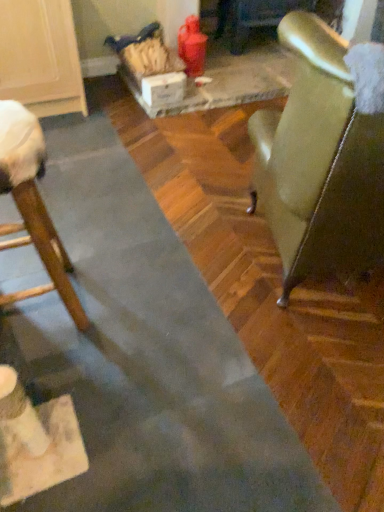
I want to click on leather-like green chair at right, arranged as the 2th chair when viewed from the left, so click(319, 163).

The height and width of the screenshot is (512, 384). Find the location of `wooden chair at left, which ranks as the first chair in left-to-right order`. wooden chair at left, which ranks as the first chair in left-to-right order is located at coordinates (32, 206).

Where is `leather-like green chair at right, the first chair when ordered from right to left`? The image size is (384, 512). leather-like green chair at right, the first chair when ordered from right to left is located at coordinates (319, 163).

In the image, is wooden chair at left, arranged as the second chair when viewed from the right, on the left side or the right side of leather-like green chair at right, arranged as the 2th chair when viewed from the left?

Based on their positions, wooden chair at left, arranged as the second chair when viewed from the right, is located to the left of leather-like green chair at right, arranged as the 2th chair when viewed from the left.

Is there a large distance between wooden chair at left, which ranks as the first chair in left-to-right order, and leather-like green chair at right, the first chair when ordered from right to left?

That's not correct — wooden chair at left, which ranks as the first chair in left-to-right order, is a little close to leather-like green chair at right, the first chair when ordered from right to left.

Which of these two, wooden chair at left, which ranks as the first chair in left-to-right order, or leather-like green chair at right, the first chair when ordered from right to left, is smaller?

Smaller between the two is wooden chair at left, which ranks as the first chair in left-to-right order.

Is wooden chair at left, arranged as the second chair when viewed from the right, oriented away from leather-like green chair at right, arranged as the 2th chair when viewed from the left?

Yes, wooden chair at left, arranged as the second chair when viewed from the right, is positioned with its back facing leather-like green chair at right, arranged as the 2th chair when viewed from the left.

Is white cardboard box at center next to leather-like green chair at right, arranged as the 2th chair when viewed from the left?

white cardboard box at center and leather-like green chair at right, arranged as the 2th chair when viewed from the left, are not in contact.

Which is in front, point (185, 74) or point (280, 193)?

The point (280, 193) is closer to the camera.

Image resolution: width=384 pixels, height=512 pixels. In order to click on the 1st chair below the white cardboard box at center (from the image's perspective) in this screenshot , I will do `click(319, 163)`.

Locate an element on the screen. Image resolution: width=384 pixels, height=512 pixels. chair lying in front of the wooden chair at left, which ranks as the first chair in left-to-right order is located at coordinates (319, 163).

Is leather-like green chair at right, arranged as the 2th chair when viewed from the left, aimed at wooden chair at left, arranged as the second chair when viewed from the right?

No, leather-like green chair at right, arranged as the 2th chair when viewed from the left, is not aimed at wooden chair at left, arranged as the second chair when viewed from the right.

From a real-world perspective, is leather-like green chair at right, arranged as the 2th chair when viewed from the left, below wooden chair at left, arranged as the second chair when viewed from the right?

Incorrect, from a real-world perspective, leather-like green chair at right, arranged as the 2th chair when viewed from the left, is higher than wooden chair at left, arranged as the second chair when viewed from the right.

Considering the points (300, 61) and (155, 106), which point is behind, point (300, 61) or point (155, 106)?

The point (155, 106) is more distant.

Which is correct: leather-like green chair at right, the first chair when ordered from right to left, is inside white cardboard box at center, or outside of it?

leather-like green chair at right, the first chair when ordered from right to left, is not inside white cardboard box at center, it's outside.

From the image's perspective, relative to white cardboard box at center, is leather-like green chair at right, the first chair when ordered from right to left, above or below?

Based on their image positions, leather-like green chair at right, the first chair when ordered from right to left, is located beneath white cardboard box at center.

In the scene shown: Which object is further away from the camera, leather-like green chair at right, arranged as the 2th chair when viewed from the left, or white cardboard box at center?

white cardboard box at center is further from the camera.

Considering the points (68, 265) and (158, 96), which point is behind, point (68, 265) or point (158, 96)?

Positioned behind is point (158, 96).

From a real-world perspective, which is physically below, wooden chair at left, arranged as the second chair when viewed from the right, or white cardboard box at center?

white cardboard box at center, from a real-world perspective.

Which of these two, wooden chair at left, arranged as the second chair when viewed from the right, or white cardboard box at center, is smaller?

Smaller between the two is white cardboard box at center.

Would you consider wooden chair at left, arranged as the second chair when viewed from the right, to be distant from white cardboard box at center?

That's right, there is a large distance between wooden chair at left, arranged as the second chair when viewed from the right, and white cardboard box at center.

Is the position of white cardboard box at center more distant than that of wooden chair at left, arranged as the second chair when viewed from the right?

Yes, white cardboard box at center is further from the camera.

Based on the photo, can you confirm if white cardboard box at center is taller than wooden chair at left, which ranks as the first chair in left-to-right order?

No, white cardboard box at center is not taller than wooden chair at left, which ranks as the first chair in left-to-right order.

Is white cardboard box at center oriented towards wooden chair at left, arranged as the second chair when viewed from the right?

No, white cardboard box at center is not aimed at wooden chair at left, arranged as the second chair when viewed from the right.

Is wooden chair at left, which ranks as the first chair in left-to-right order, surrounded by white cardboard box at center?

No, wooden chair at left, which ranks as the first chair in left-to-right order, is not surrounded by white cardboard box at center.

You are a GUI agent. You are given a task and a screenshot of the screen. Output one action in this format:
    pyautogui.click(x=<x>, y=<y>)
    Task: Click on the chair in front of the wooden chair at left, arranged as the second chair when viewed from the right
    The height and width of the screenshot is (512, 384).
    Given the screenshot: What is the action you would take?
    point(319,163)

Locate an element on the screen. This screenshot has height=512, width=384. the 2nd chair above the white cardboard box at center (from a real-world perspective) is located at coordinates (319, 163).

Considering their positions, is white cardboard box at center positioned closer to wooden chair at left, which ranks as the first chair in left-to-right order, than leather-like green chair at right, arranged as the 2th chair when viewed from the left?

leather-like green chair at right, arranged as the 2th chair when viewed from the left.

Estimate the real-world distances between objects in this image. Which object is further from leather-like green chair at right, arranged as the 2th chair when viewed from the left, white cardboard box at center or wooden chair at left, arranged as the second chair when viewed from the right?

Based on the image, white cardboard box at center appears to be further to leather-like green chair at right, arranged as the 2th chair when viewed from the left.

When comparing their distances from white cardboard box at center, does wooden chair at left, arranged as the second chair when viewed from the right, or leather-like green chair at right, the first chair when ordered from right to left, seem further?

leather-like green chair at right, the first chair when ordered from right to left, is positioned further to the anchor white cardboard box at center.

Considering their positions, is leather-like green chair at right, arranged as the 2th chair when viewed from the left, positioned closer to white cardboard box at center than wooden chair at left, which ranks as the first chair in left-to-right order?

Based on the image, wooden chair at left, which ranks as the first chair in left-to-right order, appears to be nearer to white cardboard box at center.

Estimate the real-world distances between objects in this image. Which object is further from wooden chair at left, which ranks as the first chair in left-to-right order, leather-like green chair at right, arranged as the 2th chair when viewed from the left, or white cardboard box at center?

white cardboard box at center.

When comparing their distances from leather-like green chair at right, arranged as the 2th chair when viewed from the left, does wooden chair at left, which ranks as the first chair in left-to-right order, or white cardboard box at center seem closer?

Among the two, wooden chair at left, which ranks as the first chair in left-to-right order, is located nearer to leather-like green chair at right, arranged as the 2th chair when viewed from the left.

This screenshot has width=384, height=512. Find the location of `chair located between leather-like green chair at right, arranged as the 2th chair when viewed from the left, and white cardboard box at center in the depth direction`. chair located between leather-like green chair at right, arranged as the 2th chair when viewed from the left, and white cardboard box at center in the depth direction is located at coordinates (32, 206).